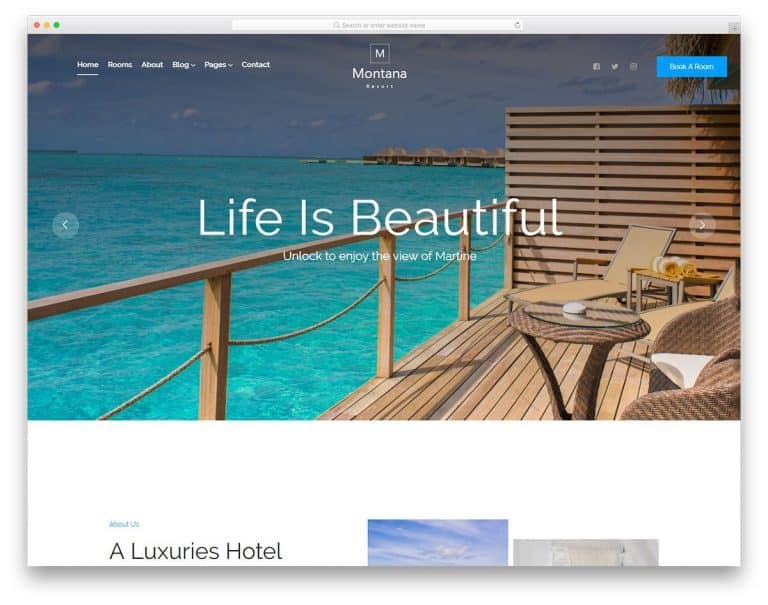
I want to click on straw chairs, so click(694, 341), click(694, 400).